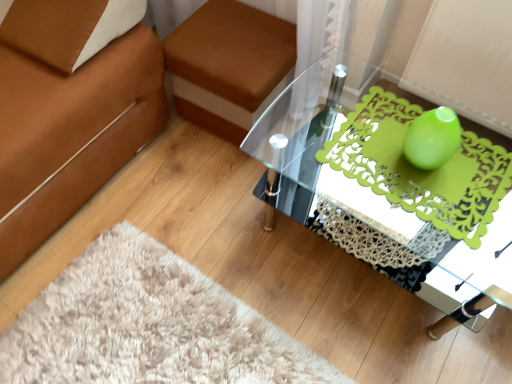
Where is `empty space that is ontop of green matte vase at upper right (from a real-world perspective)`? The height and width of the screenshot is (384, 512). empty space that is ontop of green matte vase at upper right (from a real-world perspective) is located at coordinates (419, 169).